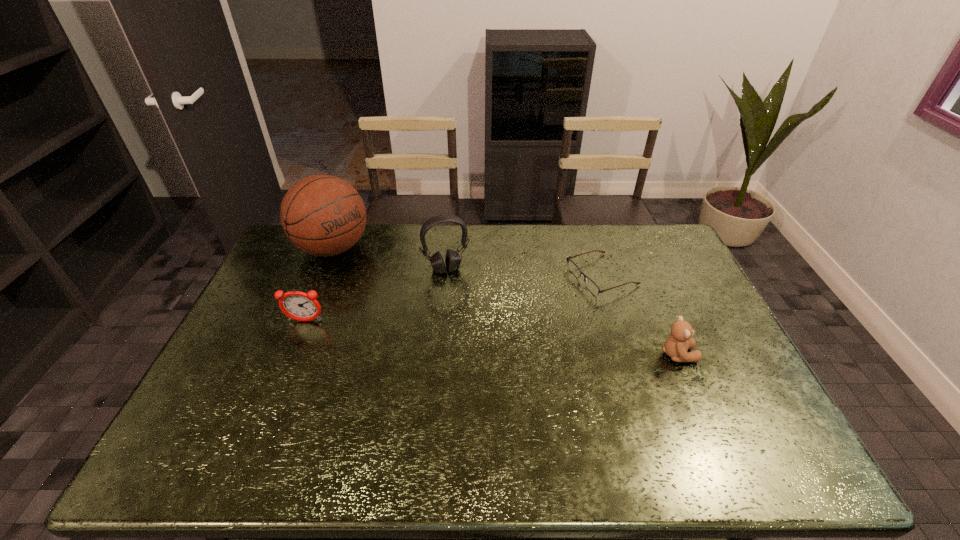
The width and height of the screenshot is (960, 540). What are the coordinates of `alarm clock that is at the left edge` in the screenshot? It's located at (300, 306).

Locate an element on the screen. The image size is (960, 540). basketball situated at the left edge is located at coordinates (323, 215).

I want to click on object located in the right edge section of the desktop, so click(676, 346).

The width and height of the screenshot is (960, 540). In order to click on object that is at the far left corner in this screenshot , I will do `click(323, 215)`.

This screenshot has height=540, width=960. In the image, there is a desktop. In order to click on vacant space at the far edge in this screenshot , I will do `click(443, 231)`.

Where is `blank space at the near edge`? The image size is (960, 540). blank space at the near edge is located at coordinates (410, 429).

In the image, there is a desktop. Find the location of `vacant space at the left edge`. vacant space at the left edge is located at coordinates (312, 266).

This screenshot has width=960, height=540. Find the location of `vacant space at the right edge`. vacant space at the right edge is located at coordinates click(674, 320).

Find the location of `vacant area at the far left corner`. vacant area at the far left corner is located at coordinates (312, 260).

Find the location of a particular element. This screenshot has width=960, height=540. free space at the far right corner is located at coordinates (646, 238).